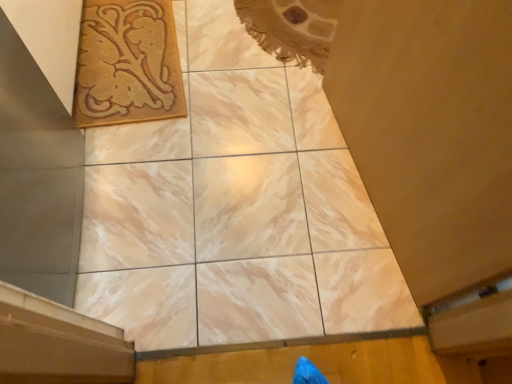
Locate an element on the screen. empty space that is to the right of beige woven rug at upper left is located at coordinates (227, 84).